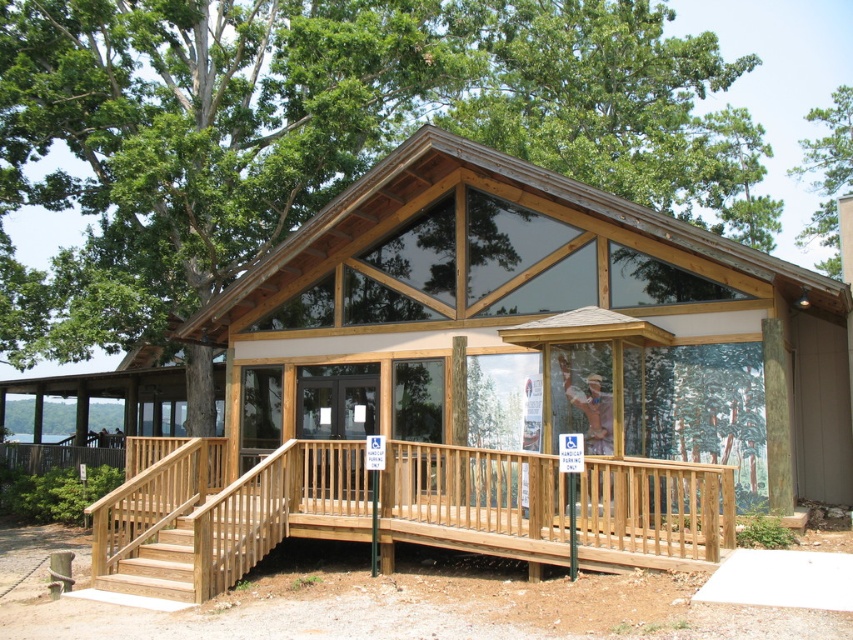
You are a visitor trying to enter the building. You see the wooden ramp at lower left and the green leafy tree at upper right. Which one is closer to the entrance?

The wooden ramp at lower left is closer to the entrance because it is smaller than the green leafy tree at upper right, indicating it is positioned nearer to the observer.

You are a visitor approaching the building and want to enter. You see the wooden ramp at lower left and the green leafy tree at upper right. Which object is closer to the entrance?

The wooden ramp at lower left is closer to the entrance because it is located below the green leafy tree at upper right, indicating its position near the entrance area.

You are standing at the entrance of the modern building and want to take a photo of the point marked at coordinates (x=627, y=291). The camera you are using has a focal length of 50mm and a sensor size of 24mm x 36mm. Can you estimate whether the point is within the camera sensor frame?

The point marked at coordinates (x=627, y=291) is 11.35 meters away from the camera. To determine if it is within the sensor frame, we need to calculate the field of view. The horizontal field of view is 2 arctan36mm22.88mm, and the vertical field of view is 2 arctan24mm22.88mm. The coordinates 0.456 and 0.736 represent the normalized position on the sensor. Since the distance is 11.35 meters, the actual position on the sensor can be calculated using trigonometry. However, without knowing the exact angle or a